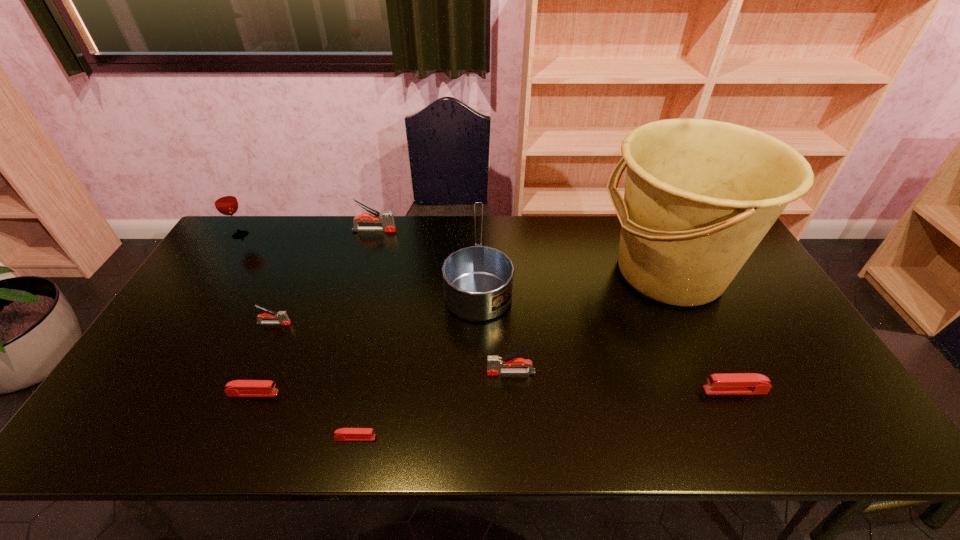
Identify which object is the fifth closest to the bucket. Please provide its 2D coordinates. Your answer should be formatted as a tuple, i.e. [(x, y)], where the tuple contains the x and y coordinates of a point satisfying the conditions above.

[(343, 434)]

The image size is (960, 540). What are the coordinates of `object identified as the seventh closest to the third farthest stapler` in the screenshot? It's located at (386, 218).

The image size is (960, 540). I want to click on stapler that stands as the third closest to the fourth nearest stapler, so click(238, 388).

Identify which stapler is located as the fifth nearest to the nearest gray stapler. Please provide its 2D coordinates. Your answer should be formatted as a tuple, i.e. [(x, y)], where the tuple contains the x and y coordinates of a point satisfying the conditions above.

[(386, 218)]

This screenshot has height=540, width=960. Find the location of `the second closest gray stapler relative to the second shortest object`. the second closest gray stapler relative to the second shortest object is located at coordinates pos(495,366).

Point out which gray stapler is positioned as the nearest to the second gray stapler from left to right. Please provide its 2D coordinates. Your answer should be formatted as a tuple, i.e. [(x, y)], where the tuple contains the x and y coordinates of a point satisfying the conditions above.

[(282, 316)]

Point out which red stapler is positioned as the second nearest to the saucepan. Please provide its 2D coordinates. Your answer should be formatted as a tuple, i.e. [(x, y)], where the tuple contains the x and y coordinates of a point satisfying the conditions above.

[(238, 388)]

Locate which red stapler is the second closest to the nearest object. Please provide its 2D coordinates. Your answer should be formatted as a tuple, i.e. [(x, y)], where the tuple contains the x and y coordinates of a point satisfying the conditions above.

[(732, 383)]

Find the location of a particular element. This screenshot has width=960, height=540. free space that satisfies the following two spatial constraints: 1. on the handle side of the farthest gray stapler; 2. with the handle extending from one side of the saucepan is located at coordinates (364, 267).

Locate an element on the screen. free spot that satisfies the following two spatial constraints: 1. on the handle side of the farthest stapler; 2. with the handle extending from one side of the saucepan is located at coordinates (364, 267).